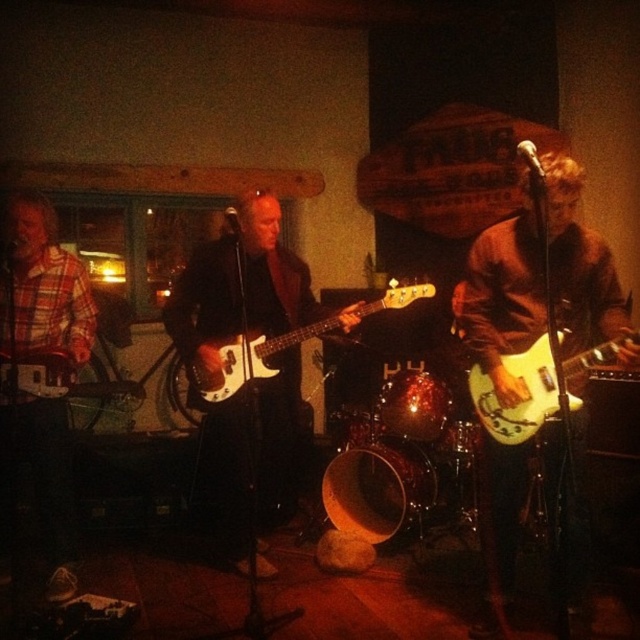
Based on the photo, you are a stagehand setting up for a concert and need to place a protective cover over the guitars. The cover you have is designed to fit guitars wider than 40 cm. Based on the image, which guitar between the matte white guitar at center and the white glossy electric guitar at center would require a larger cover?

The white glossy electric guitar at center requires a larger cover because its width is greater than the matte white guitar at center.

You are standing in the venue and want to take a photo of the point at coordinates (465, 324). The camera you have can focus on objects between 2 and 3 meters away. Will the point be in focus?

The point at coordinates (465, 324) is 2.96 meters from the viewer, which is within the camera focus range of 2 to 3 meters. Therefore, the point will be in focus.